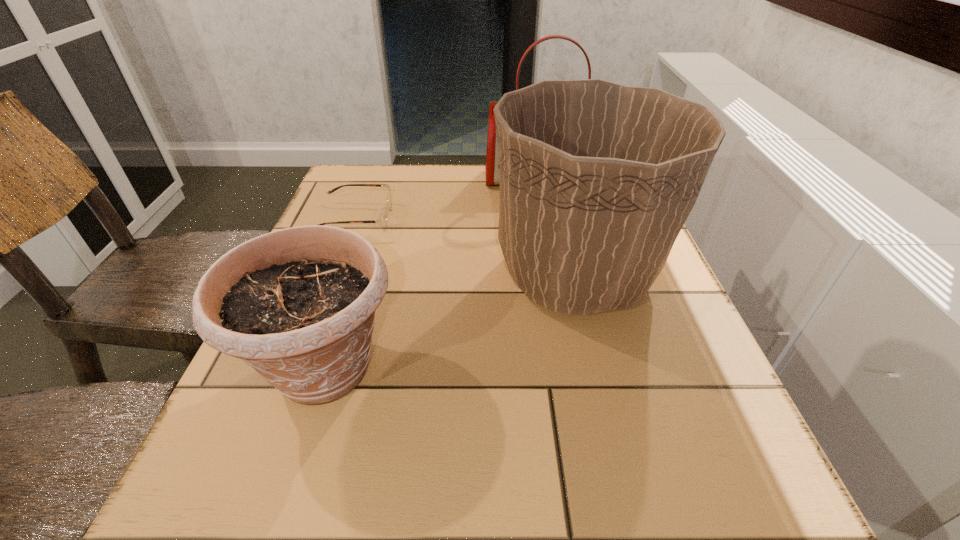
Image resolution: width=960 pixels, height=540 pixels. Identify the location of vacant area between the spectacles and the taller flowerpot. [466, 247].

The image size is (960, 540). I want to click on vacant space in between the taller flowerpot and the third tallest object, so click(x=450, y=321).

Point out which object is positioned as the third nearest to the taller flowerpot. Please provide its 2D coordinates. Your answer should be formatted as a tuple, i.e. [(x, y)], where the tuple contains the x and y coordinates of a point satisfying the conditions above.

[(382, 220)]

This screenshot has height=540, width=960. What are the coordinates of `object that is the second closest to the third tallest object` in the screenshot? It's located at (382, 220).

Locate an element on the screen. The image size is (960, 540). vacant space that satisfies the following two spatial constraints: 1. on the front-facing side of the shortest object; 2. on the left side of the left flowerpot is located at coordinates (300, 368).

The height and width of the screenshot is (540, 960). Identify the location of vacant space that satisfies the following two spatial constraints: 1. on the front-facing side of the spectacles; 2. on the left side of the taller flowerpot. (335, 274).

The image size is (960, 540). In order to click on vacant region that satisfies the following two spatial constraints: 1. on the front-facing side of the spectacles; 2. on the right side of the taller flowerpot in this screenshot , I will do `click(335, 274)`.

This screenshot has height=540, width=960. Find the location of `vacant region that satisfies the following two spatial constraints: 1. on the front-facing side of the shortest object; 2. on the back side of the left flowerpot`. vacant region that satisfies the following two spatial constraints: 1. on the front-facing side of the shortest object; 2. on the back side of the left flowerpot is located at coordinates (300, 368).

I want to click on free point that satisfies the following two spatial constraints: 1. on the front-facing side of the shortest object; 2. on the back side of the right flowerpot, so click(335, 274).

Identify the location of blank area in the image that satisfies the following two spatial constraints: 1. on the back side of the left flowerpot; 2. on the front-facing side of the spectacles. The width and height of the screenshot is (960, 540). (372, 219).